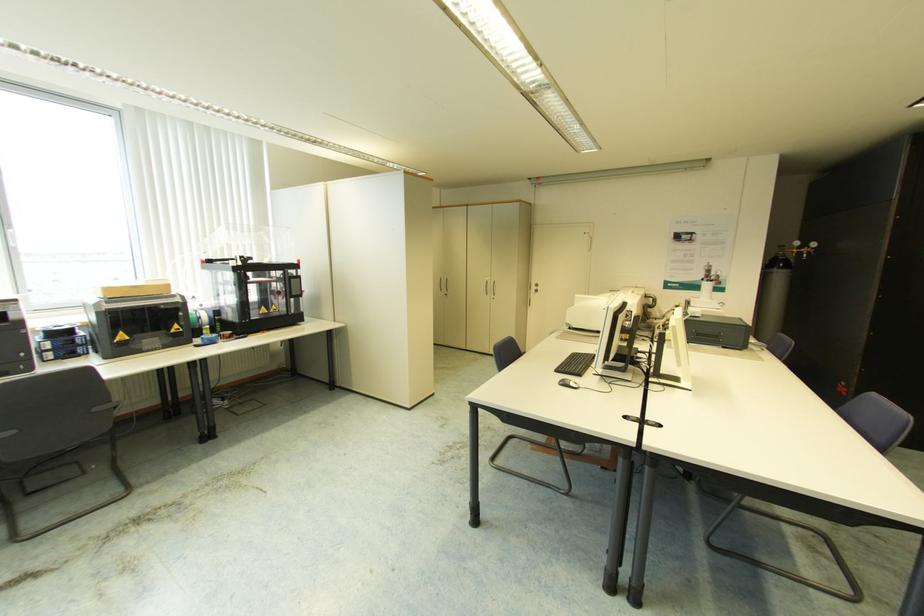
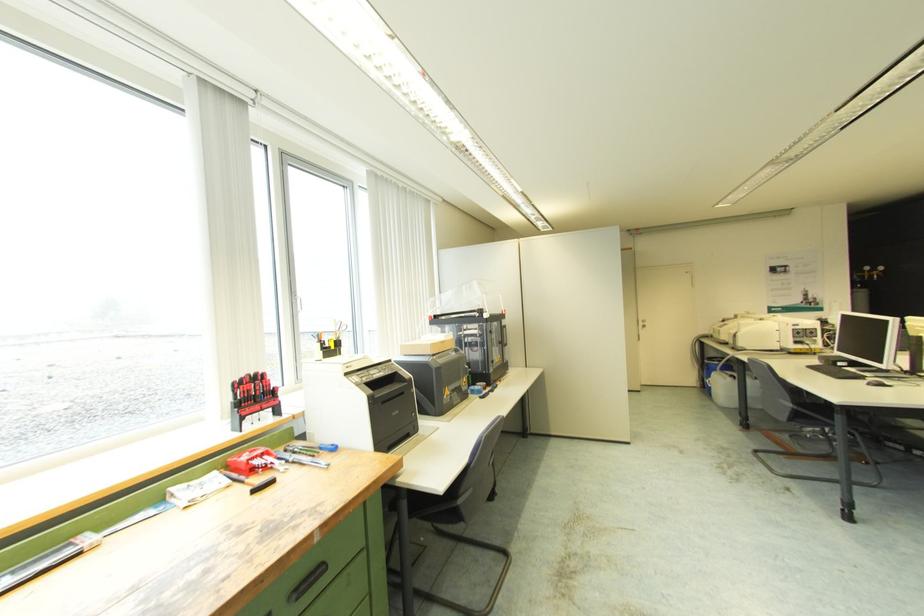
Question: Which direction would the cameraman need to move to produce the second image? Reply with the corresponding letter.

Choices:
 (A) Left
 (B) Right
 (C) Forward
 (D) Backward

Answer: (A)